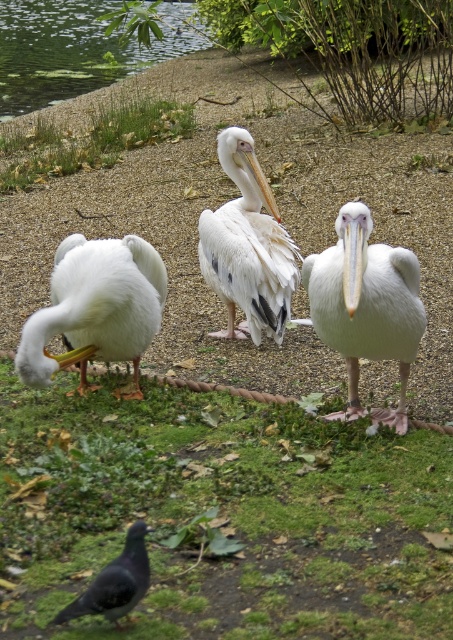
How far apart are white matte pelican at lower left and gray matte pigeon at lower left?

The distance of white matte pelican at lower left from gray matte pigeon at lower left is 5.23 feet.

Between white matte pelican at lower left and gray matte pigeon at lower left, which one is positioned lower?

gray matte pigeon at lower left

Between point (34, 310) and point (115, 609), which one is positioned in front?

Point (115, 609) is more forward.

Find the location of a particular element. white matte pelican at lower left is located at coordinates (96, 308).

Is point (247, 435) behind point (111, 598)?

Yes, point (247, 435) is farther from viewer.

Is green grass at lower left to the left of gray matte pigeon at lower left from the viewer's perspective?

Incorrect, green grass at lower left is not on the left side of gray matte pigeon at lower left.

This screenshot has height=640, width=453. In order to click on green grass at lower left in this screenshot , I will do `click(221, 516)`.

Can you confirm if green algae water at upper left is positioned to the left of matte white beak at center?

Correct, you'll find green algae water at upper left to the left of matte white beak at center.

Who is taller, green algae water at upper left or matte white beak at center?

green algae water at upper left is taller.

The image size is (453, 640). What are the coordinates of `green algae water at upper left` in the screenshot? It's located at (75, 49).